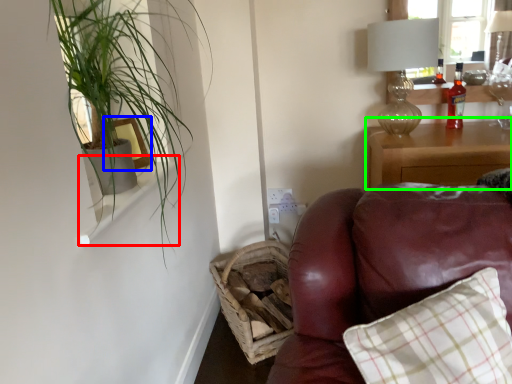
Question: Which object is the farthest from window sill (highlighted by a red box)? Choose among these: picture frame (highlighted by a blue box) or nightstand (highlighted by a green box).

Choices:
 (A) picture frame
 (B) nightstand

Answer: (B)